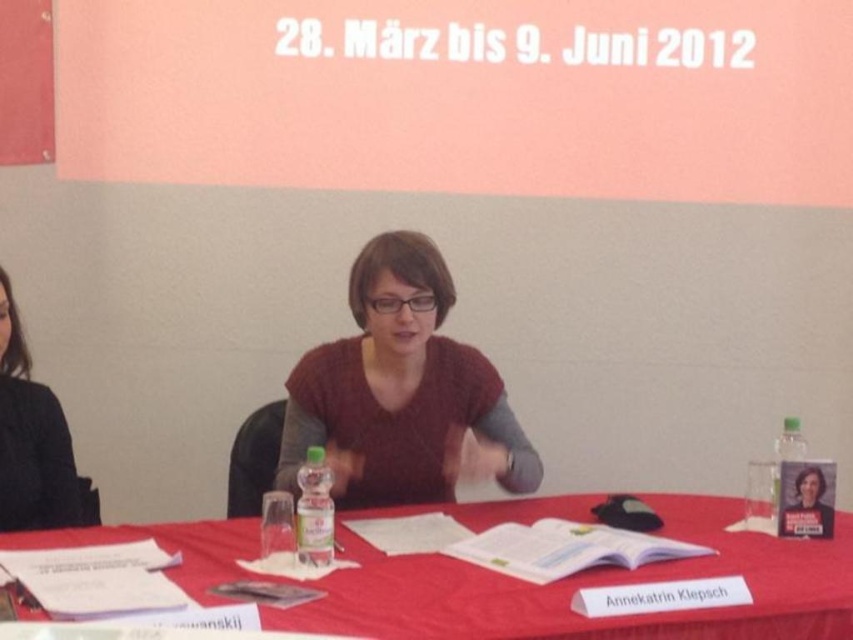
You are organizing a meeting and need to place a new item on the table. The item requires a space larger than the clear plastic bottle at right. Can the red cloth table at center accommodate this item?

The red cloth table at center has a larger size compared to the clear plastic bottle at right, so it can accommodate an item requiring a space larger than the clear plastic bottle at right.

You are standing in front of the table and want to place a small object on the table. You have two options for placement based on the coordinates given. Which coordinate point, point A at (206, 561) or point B at (6, 458), is closer to you and thus safer to reach without moving your chair?

Point A at (206, 561) is closer to the viewer than point B at (6, 458), so placing the object there would be safer as it is within easier reach.